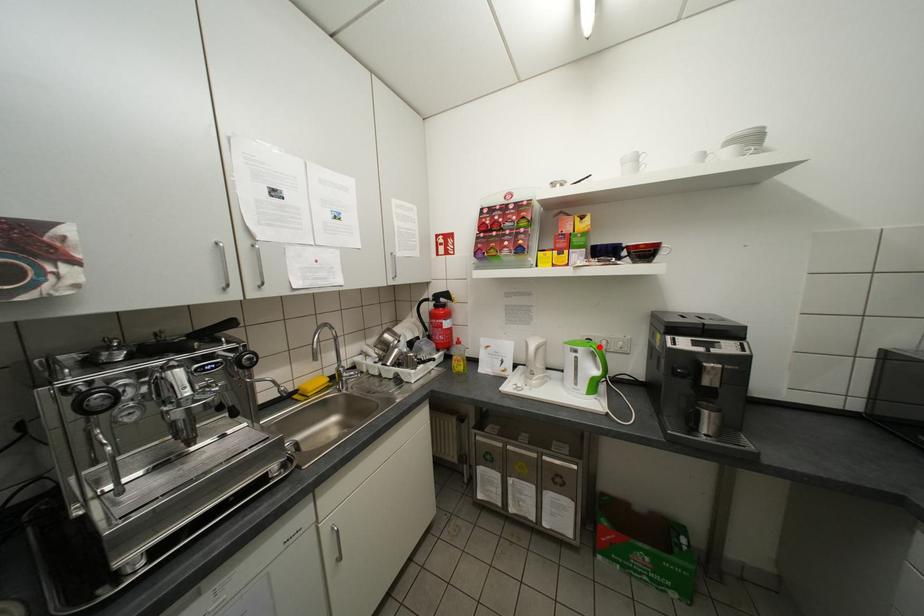
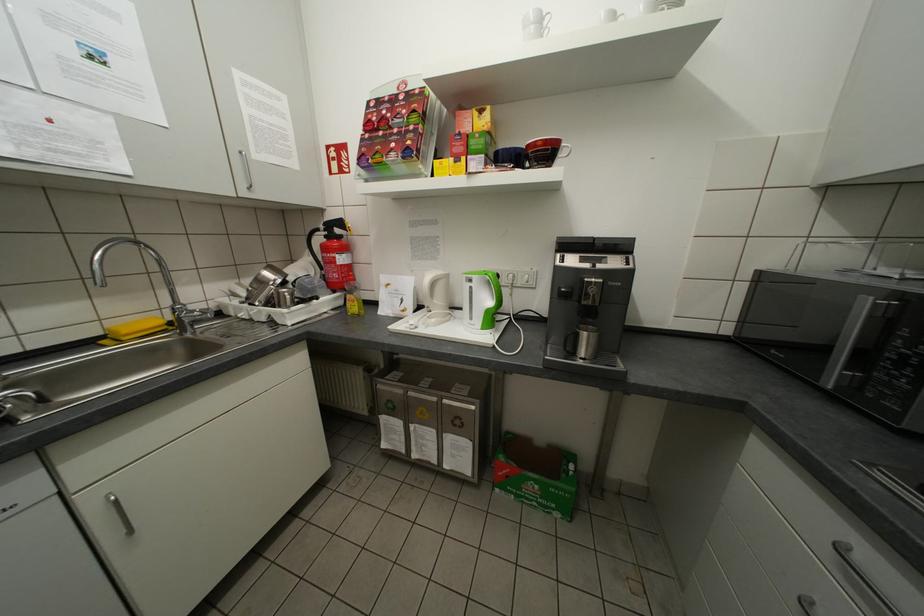
Find the pixel in the second image that matches the highlighted location in the first image.

(494, 274)